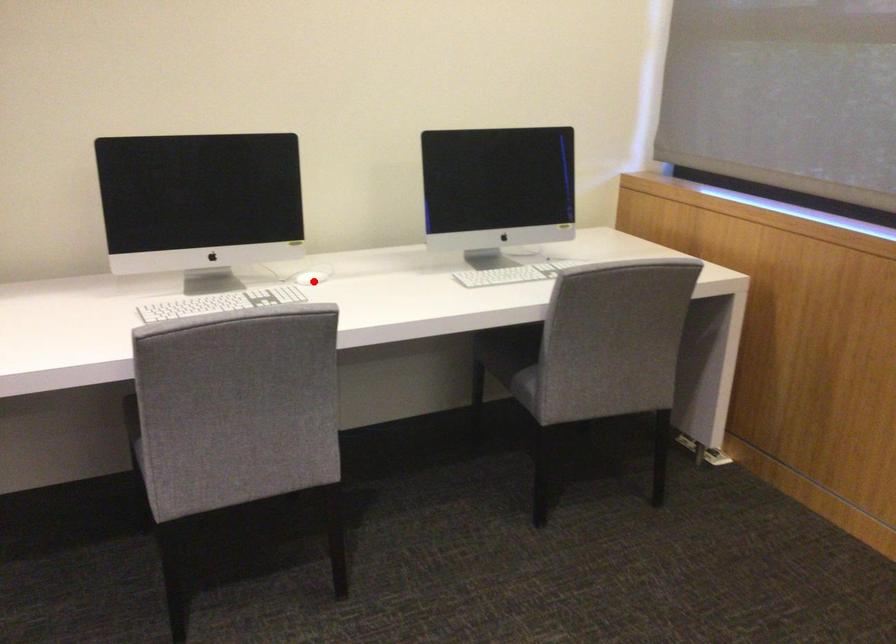
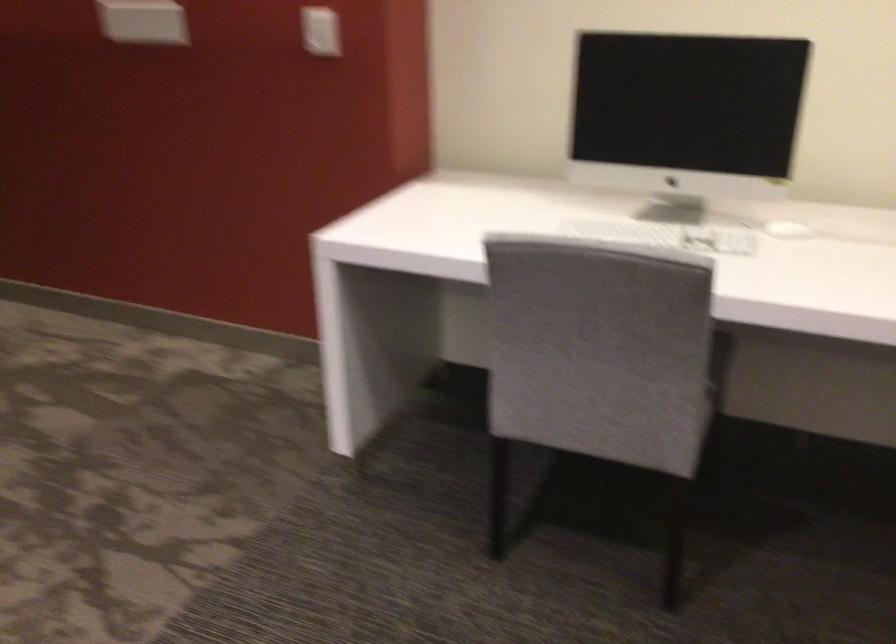
Question: I am providing you with two images of the same scene from different viewpoints. Image1 has a red point marked. In image2, the corresponding 3D location appears at what relative position? Reply with the corresponding letter.

Choices:
 (A) Closer
 (B) Farther

Answer: (A)